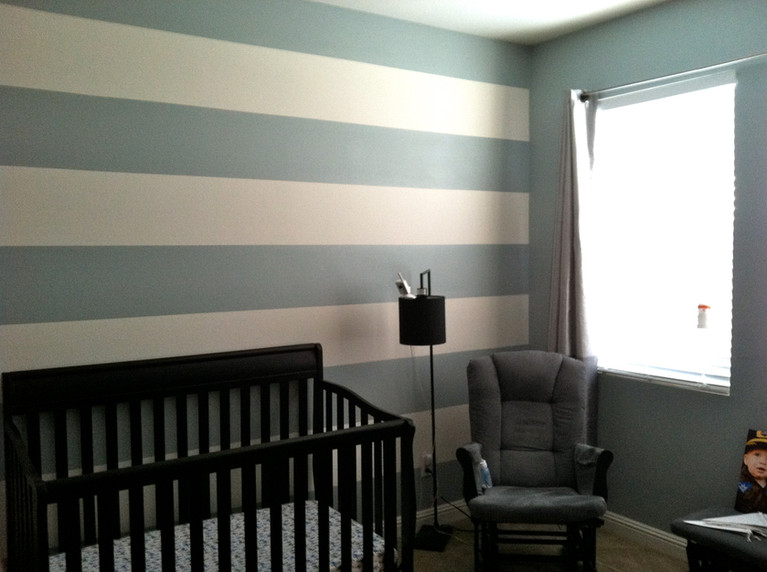
At what (x,y) coordinates should I click in order to perform the action: click on beige wall stripes. Please return your answer as a coordinate pair (x, y). The height and width of the screenshot is (572, 767). Looking at the image, I should click on (446, 425), (458, 319), (452, 232), (440, 121).